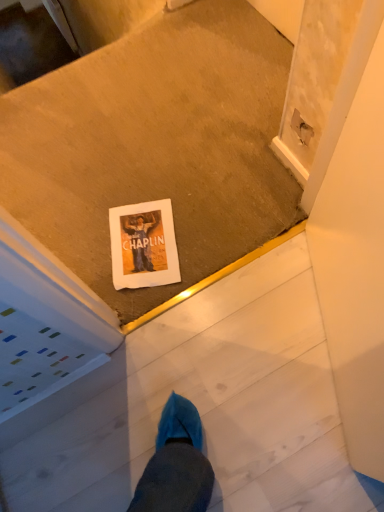
The width and height of the screenshot is (384, 512). In order to click on free space below white paper at center (from a real-world perspective) in this screenshot , I will do `click(146, 242)`.